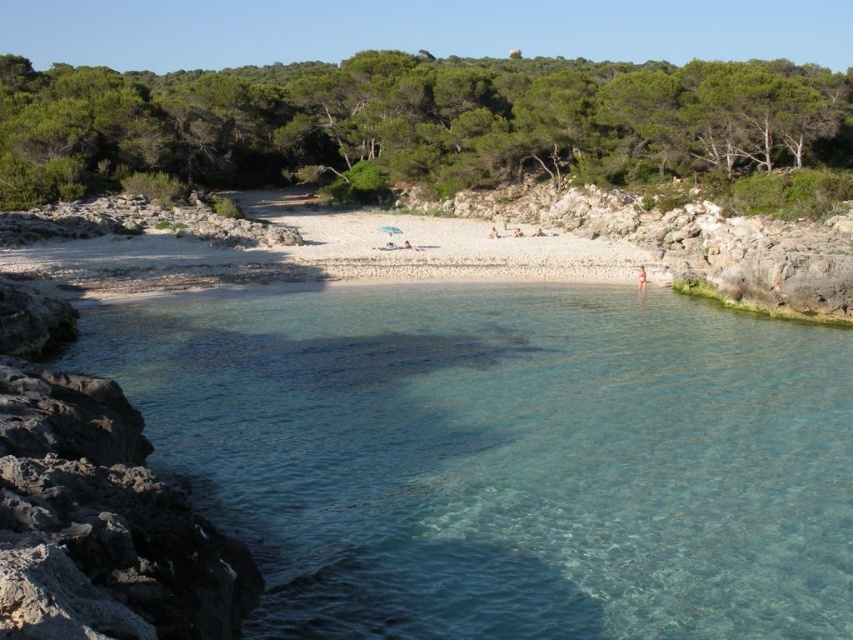
Question: Is clear glass water at center thinner than white gravel beach at center?

Choices:
 (A) no
 (B) yes

Answer: (A)

Question: Can you confirm if clear glass water at center is bigger than white gravel beach at center?

Choices:
 (A) no
 (B) yes

Answer: (B)

Question: Among these objects, which one is nearest to the camera?

Choices:
 (A) clear glass water at center
 (B) white gravel beach at center

Answer: (A)

Question: Which of the following is the closest to the observer?

Choices:
 (A) clear glass water at center
 (B) white gravel beach at center

Answer: (A)

Question: Is clear glass water at center to the left of white gravel beach at center from the viewer's perspective?

Choices:
 (A) no
 (B) yes

Answer: (A)